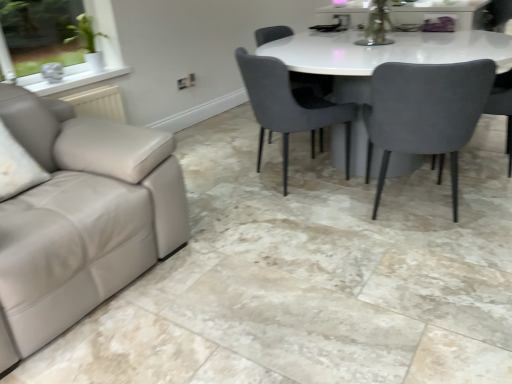
Locate an element on the screen. The height and width of the screenshot is (384, 512). free space that is to the left of velvet grey chair at center, positioned as the third chair in right-to-left order is located at coordinates (218, 142).